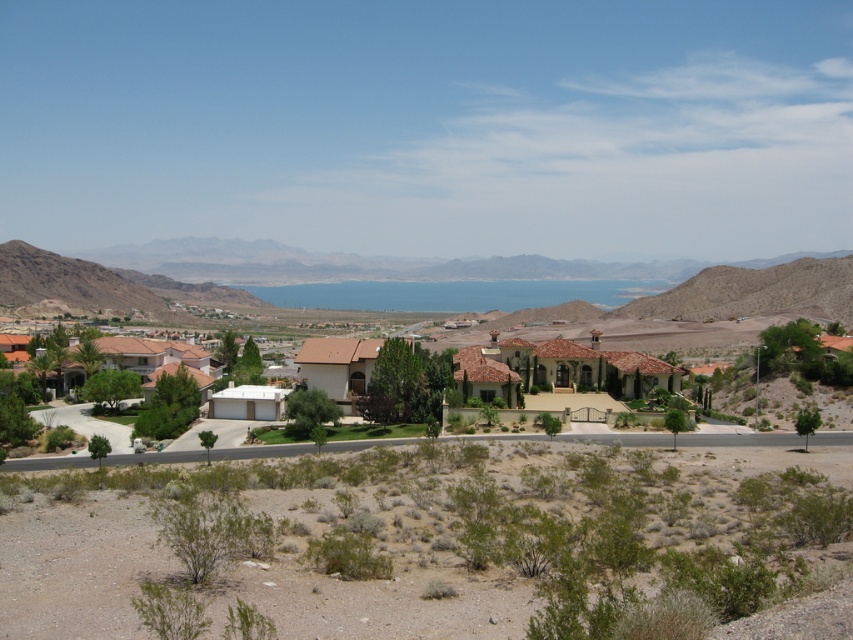
You are standing at the edge of the dry landscape and want to take a photo of the brown tile roof houses at center. However, you notice the green shrubbery at lower center is blocking your view. Can you determine if the shrubbery is between you and the houses?

The green shrubbery at lower center is in front of the brown tile roof houses at center, so yes, the shrubbery is between you and the houses.

You are standing at the edge of the desert sand at left and want to reach the brown tile roof houses at center. Which direction should you walk to get there?

You should walk to the right because the desert sand at left is positioned on the left side of brown tile roof houses at center, so moving right would lead towards them.

Consider the image. You are a landscape architect planning to plant new shrubs in the residential area. You have a limited budget and can only choose one area between the green shrubbery at lower center and the desert sand at left. Based on their sizes, which area would be more cost effective for planting new shrubs?

The green shrubbery at lower center is smaller than the desert sand at left, so planting new shrubs in the desert sand at left would be more cost effective due to its larger area.